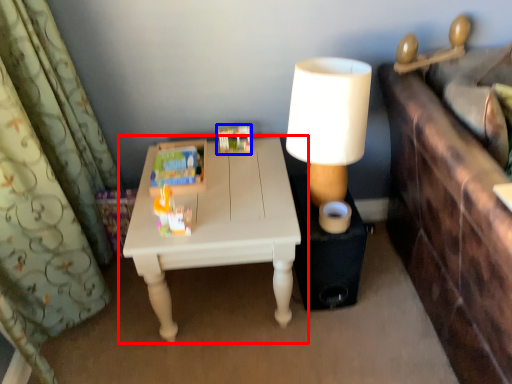
Question: Which of the following is the closest to the observer, table (highlighted by a red box) or toy (highlighted by a blue box)?

Choices:
 (A) table
 (B) toy

Answer: (A)